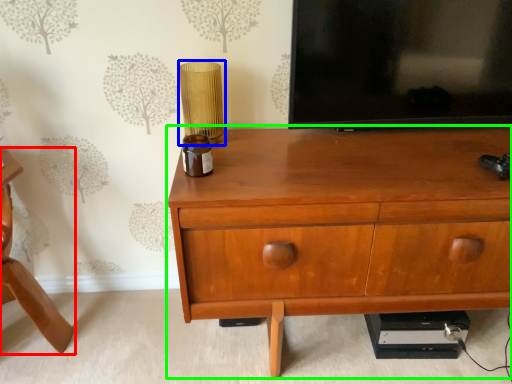
Question: Which object is the farthest from furniture (highlighted by a red box)? Choose among these: table lamp (highlighted by a blue box) or chest of drawers (highlighted by a green box).

Choices:
 (A) table lamp
 (B) chest of drawers

Answer: (B)